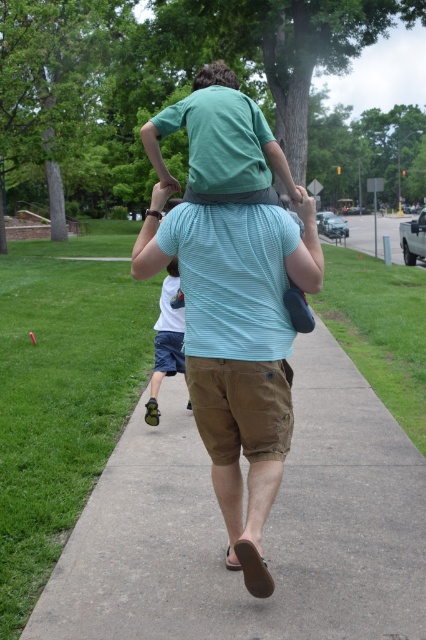
Is matte green shirt at center to the left of light blue shorts at center from the viewer's perspective?

Incorrect, matte green shirt at center is not on the left side of light blue shorts at center.

Describe the element at coordinates (221, 141) in the screenshot. Image resolution: width=426 pixels, height=640 pixels. I see `matte green shirt at center` at that location.

This screenshot has width=426, height=640. I want to click on matte green shirt at center, so click(x=221, y=141).

The width and height of the screenshot is (426, 640). Describe the element at coordinates (264, 529) in the screenshot. I see `concrete at center` at that location.

Based on the photo, can you confirm if concrete at center is taller than dark brown hair at upper center?

In fact, concrete at center may be shorter than dark brown hair at upper center.

You are a GUI agent. You are given a task and a screenshot of the screen. Output one action in this format:
    pyautogui.click(x=<x>, y=<y>)
    Task: Click on the concrete at center
    
    Given the screenshot: What is the action you would take?
    pyautogui.click(x=264, y=529)

Between concrete at center and light blue shorts at center, which one appears on the left side from the viewer's perspective?

light blue shorts at center is more to the left.

Is point (172, 401) positioned in front of point (155, 365)?

No.

The image size is (426, 640). In order to click on concrete at center in this screenshot , I will do `click(264, 529)`.